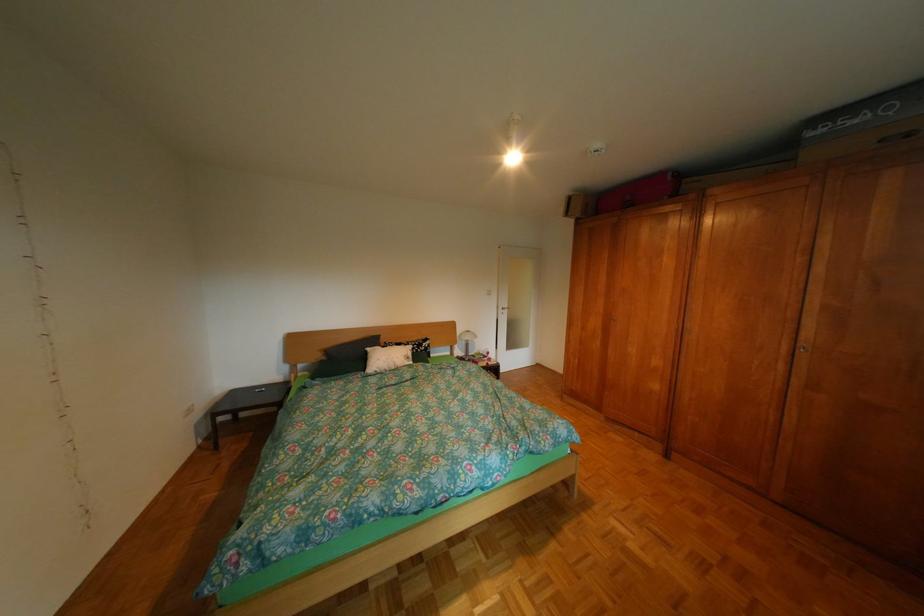
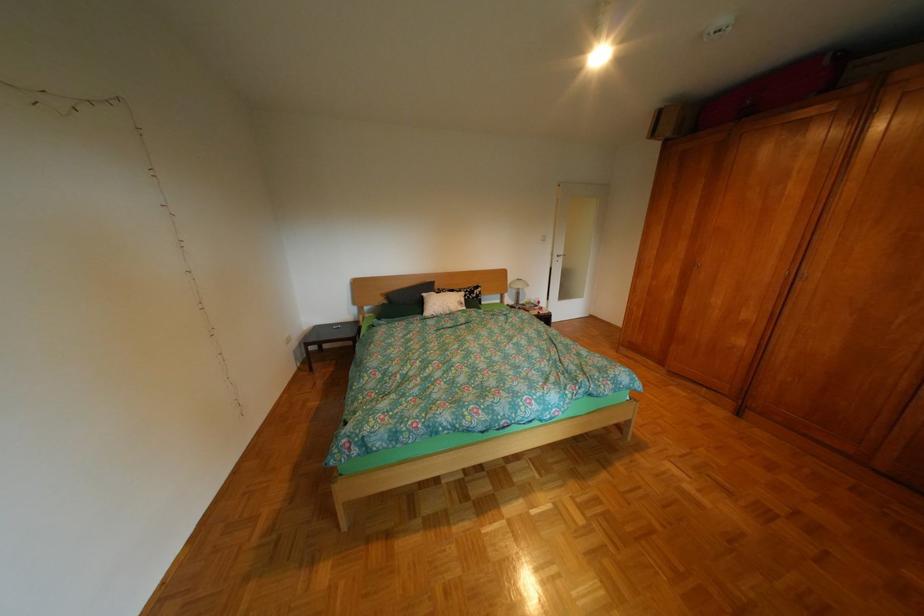
The point at (469, 342) is marked in the first image. Where is the corresponding point in the second image?

(521, 292)